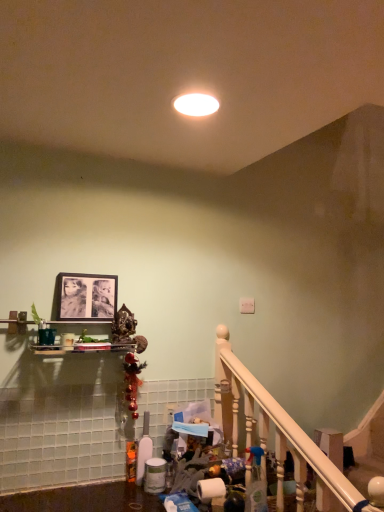
Question: Is matte black picture frame at upper center at the left side of white wooden railing at lower right?

Choices:
 (A) yes
 (B) no

Answer: (A)

Question: From the image's perspective, is matte black picture frame at upper center located above white wooden railing at lower right?

Choices:
 (A) yes
 (B) no

Answer: (A)

Question: Is matte black picture frame at upper center not inside white wooden railing at lower right?

Choices:
 (A) no
 (B) yes

Answer: (B)

Question: Does matte black picture frame at upper center touch white wooden railing at lower right?

Choices:
 (A) yes
 (B) no

Answer: (B)

Question: From a real-world perspective, is matte black picture frame at upper center below white wooden railing at lower right?

Choices:
 (A) yes
 (B) no

Answer: (B)

Question: From the image's perspective, is matte black picture frame at upper center located beneath white wooden railing at lower right?

Choices:
 (A) no
 (B) yes

Answer: (A)

Question: Can you confirm if clear plastic spray bottle at lower center is positioned to the left of white glossy light fixture at center?

Choices:
 (A) no
 (B) yes

Answer: (A)

Question: Is clear plastic spray bottle at lower center placed right next to white glossy light fixture at center?

Choices:
 (A) no
 (B) yes

Answer: (A)

Question: Does clear plastic spray bottle at lower center have a larger size compared to white glossy light fixture at center?

Choices:
 (A) yes
 (B) no

Answer: (A)

Question: From a real-world perspective, is clear plastic spray bottle at lower center over white glossy light fixture at center?

Choices:
 (A) yes
 (B) no

Answer: (B)

Question: Does clear plastic spray bottle at lower center have a lesser height compared to white glossy light fixture at center?

Choices:
 (A) yes
 (B) no

Answer: (B)

Question: Does clear plastic spray bottle at lower center appear on the right side of white glossy light fixture at center?

Choices:
 (A) yes
 (B) no

Answer: (A)

Question: Does white wooden railing at lower right have a lesser height compared to white glossy light fixture at center?

Choices:
 (A) no
 (B) yes

Answer: (A)